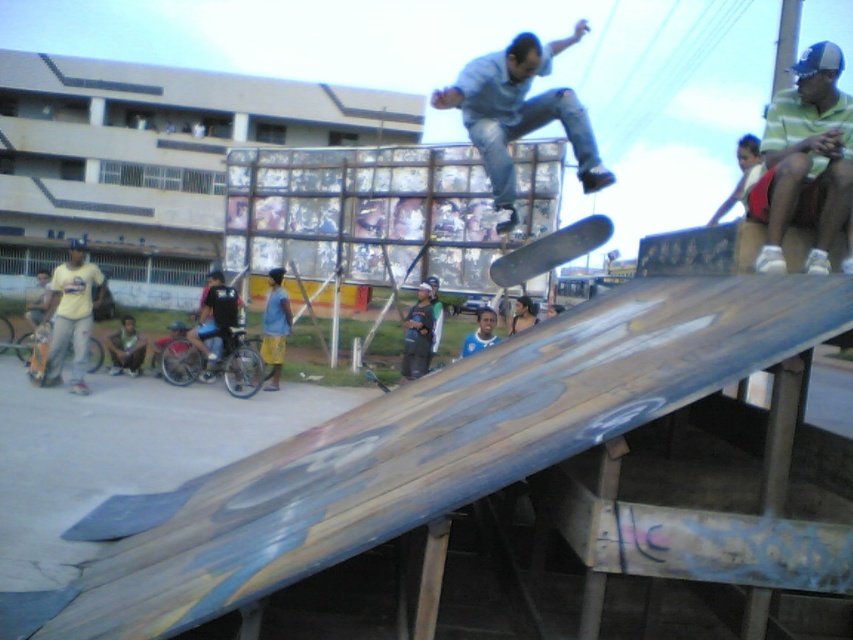
Find the location of a particular element. denim jeans at center is located at coordinates (519, 113).

Can you confirm if denim jeans at center is positioned above matte yellow shirt at left?

Yes, denim jeans at center is above matte yellow shirt at left.

The height and width of the screenshot is (640, 853). What do you see at coordinates (519, 113) in the screenshot? I see `denim jeans at center` at bounding box center [519, 113].

Locate an element on the screen. The image size is (853, 640). denim jeans at center is located at coordinates (519, 113).

Is denim jeans at center below smooth black skateboard at center?

Actually, denim jeans at center is above smooth black skateboard at center.

Which is behind, point (598, 189) or point (521, 253)?

Positioned behind is point (521, 253).

Locate an element on the screen. denim jeans at center is located at coordinates (519, 113).

Is point (595, 221) positioned before point (33, 349)?

Yes, point (595, 221) is in front of point (33, 349).

Is smooth black skateboard at center further to camera compared to wooden skateboard at lower left?

No, smooth black skateboard at center is in front of wooden skateboard at lower left.

Who is more forward, (503, 262) or (39, 355)?

Point (503, 262) is in front.

Find the location of a particular element. Image resolution: width=853 pixels, height=640 pixels. smooth black skateboard at center is located at coordinates (550, 250).